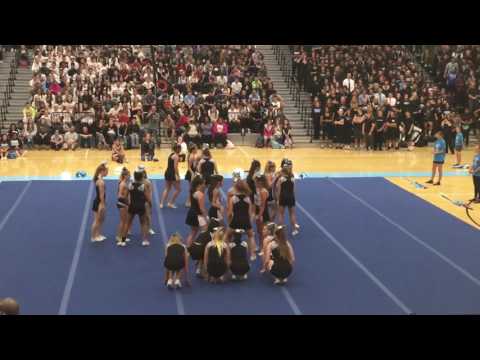
The image size is (480, 360). In order to click on wooden floor in this screenshot , I will do click(x=35, y=164), click(x=352, y=166), click(x=311, y=165).